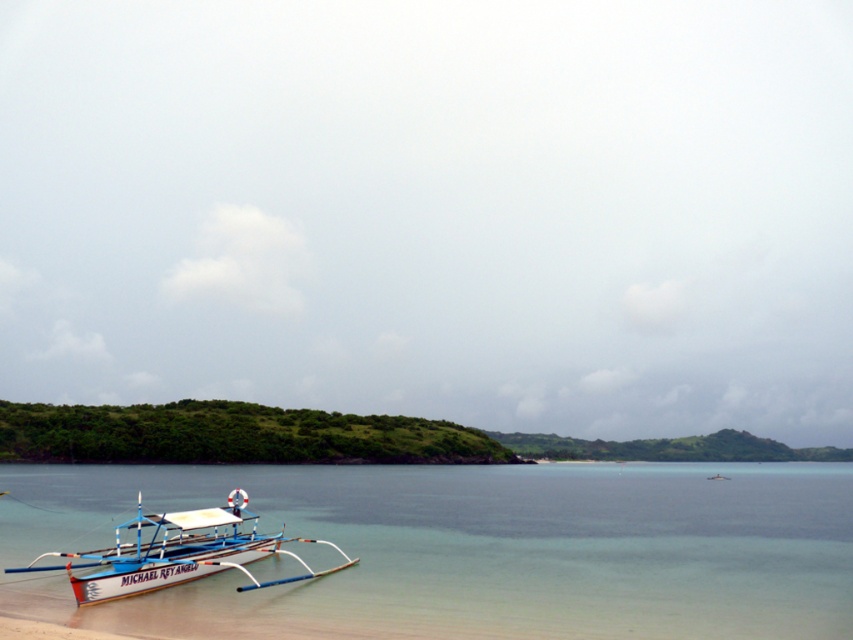
Question: Does clear blue water at lower left have a greater width compared to white matte boat at lower left?

Choices:
 (A) yes
 (B) no

Answer: (A)

Question: Does clear blue water at lower left appear under white matte boat at lower left?

Choices:
 (A) yes
 (B) no

Answer: (A)

Question: Can you confirm if clear blue water at lower left is bigger than white matte boat at lower left?

Choices:
 (A) yes
 (B) no

Answer: (A)

Question: Which point appears farthest from the camera in this image?

Choices:
 (A) click(x=108, y=564)
 (B) click(x=323, y=499)

Answer: (B)

Question: Which point appears closest to the camera in this image?

Choices:
 (A) (465, 572)
 (B) (80, 560)

Answer: (B)